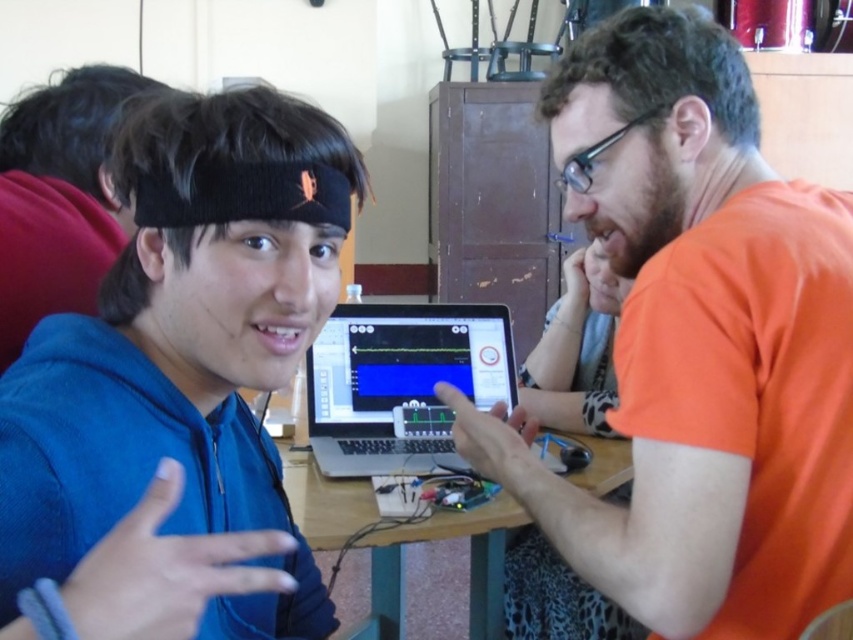
Question: Does orange matte shirt at right have a lesser width compared to blue knit cap at upper left?

Choices:
 (A) yes
 (B) no

Answer: (B)

Question: Which point is farther to the camera?

Choices:
 (A) satin silver laptop at center
 (B) blue fleece jacket at center
 (C) wooden table at center
 (D) orange matte shirt at right

Answer: (A)

Question: Which point is closer to the camera?

Choices:
 (A) (404, 532)
 (B) (621, 509)
 (C) (352, 401)
 (D) (109, 83)

Answer: (B)

Question: In this image, where is blue fleece jacket at center located relative to satin silver laptop at center?

Choices:
 (A) above
 (B) below

Answer: (B)

Question: Which object is closer to the camera taking this photo?

Choices:
 (A) satin silver laptop at center
 (B) wooden table at center

Answer: (B)

Question: Does orange matte shirt at right have a lesser width compared to wooden table at center?

Choices:
 (A) yes
 (B) no

Answer: (A)